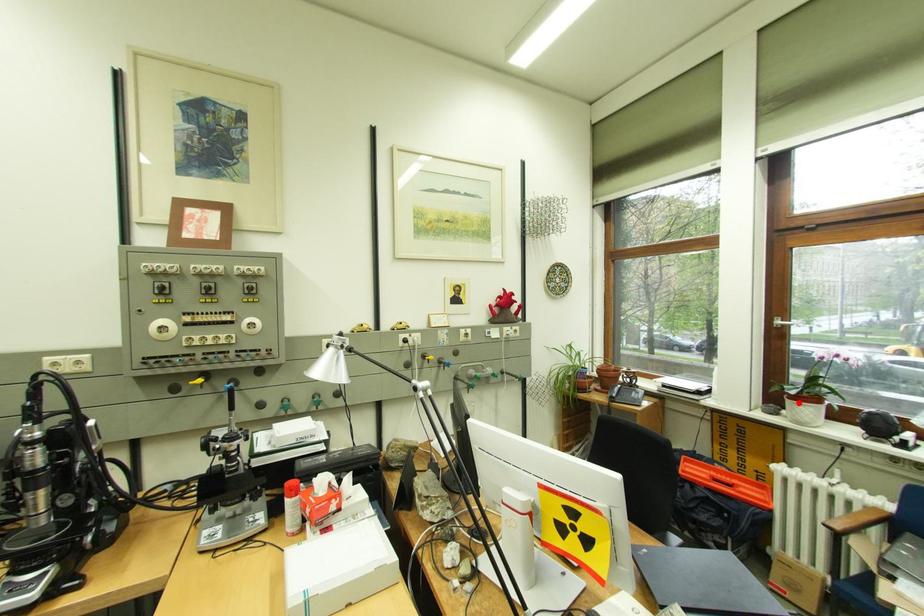
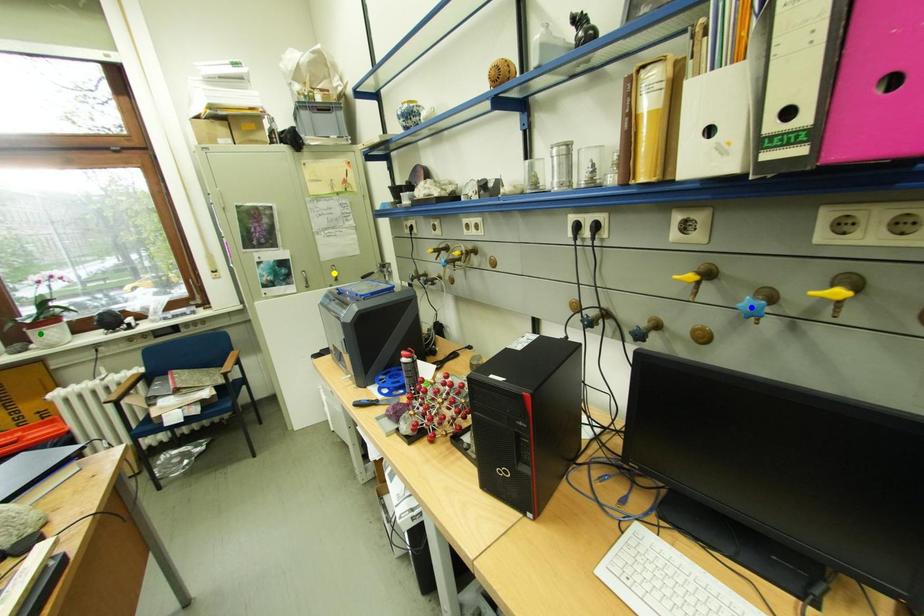
Question: I am providing you with two images of the same scene from different viewpoints. A red point is marked on the first image. You are given multiple points on the second image. Which mark in image 2 goes with the point in image 1?

Choices:
 (A) yellow point
 (B) green point
 (C) blue point

Answer: (B)